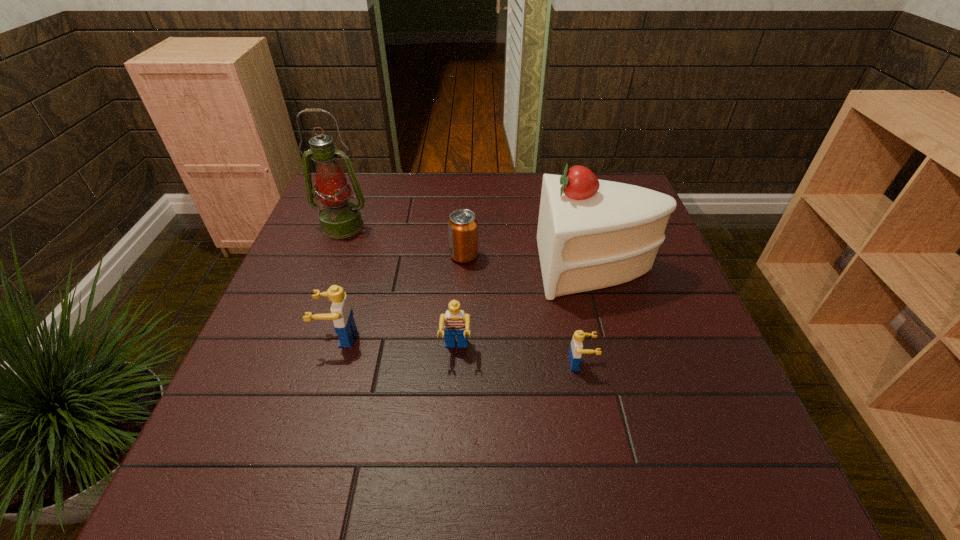
The image size is (960, 540). I want to click on blank area located on the face of the second Lego from right to left, so click(x=453, y=401).

Find the location of `vacant space located on the face of the shortest Lego`. vacant space located on the face of the shortest Lego is located at coordinates (637, 363).

At what (x,y) coordinates should I click in order to perform the action: click on free space located 0.240m on the back of the soda can. Please return your answer as a coordinate pair (x, y). The height and width of the screenshot is (540, 960). Looking at the image, I should click on (467, 198).

This screenshot has width=960, height=540. Identify the location of vacant space located on the left of the fifth shortest object. (415, 267).

Locate an element on the screen. This screenshot has width=960, height=540. blank area located 0.080m on the back of the tallest object is located at coordinates (353, 199).

Where is `object that is at the far edge`? The image size is (960, 540). object that is at the far edge is located at coordinates (340, 218).

Identify the location of Lego situated at the left edge. Image resolution: width=960 pixels, height=540 pixels. (341, 313).

Find the location of a particular element. The height and width of the screenshot is (540, 960). oil lamp at the left edge is located at coordinates pyautogui.click(x=340, y=218).

Where is `object located in the right edge section of the desktop`? The height and width of the screenshot is (540, 960). object located in the right edge section of the desktop is located at coordinates (592, 234).

I want to click on object that is at the far left corner, so click(x=340, y=218).